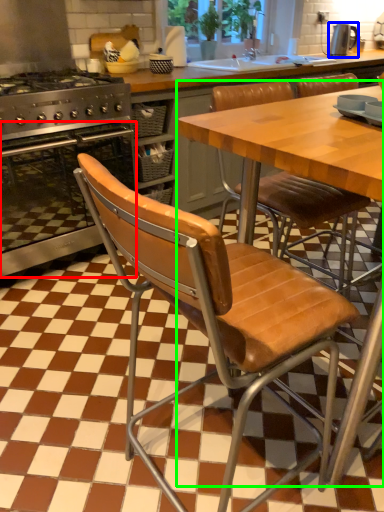
Question: Based on their relative distances, which object is farther from oven (highlighted by a red box)? Choose from kitchen appliance (highlighted by a blue box) and table (highlighted by a green box).

Choices:
 (A) kitchen appliance
 (B) table

Answer: (A)